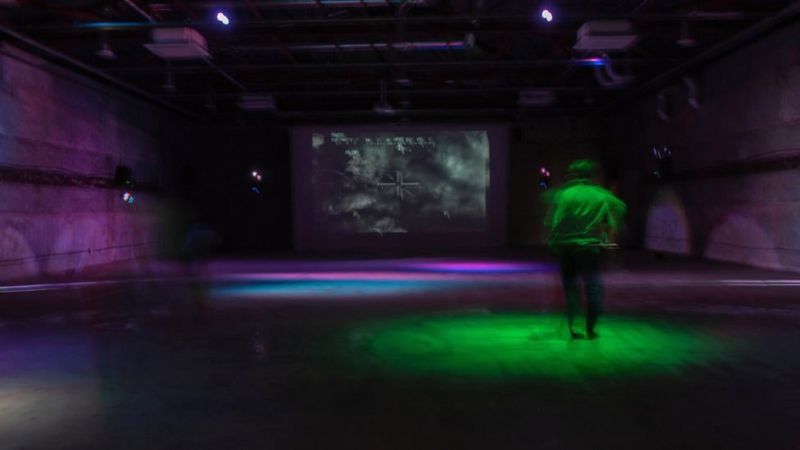
Locate an element on the screen. wall is located at coordinates (773, 219).